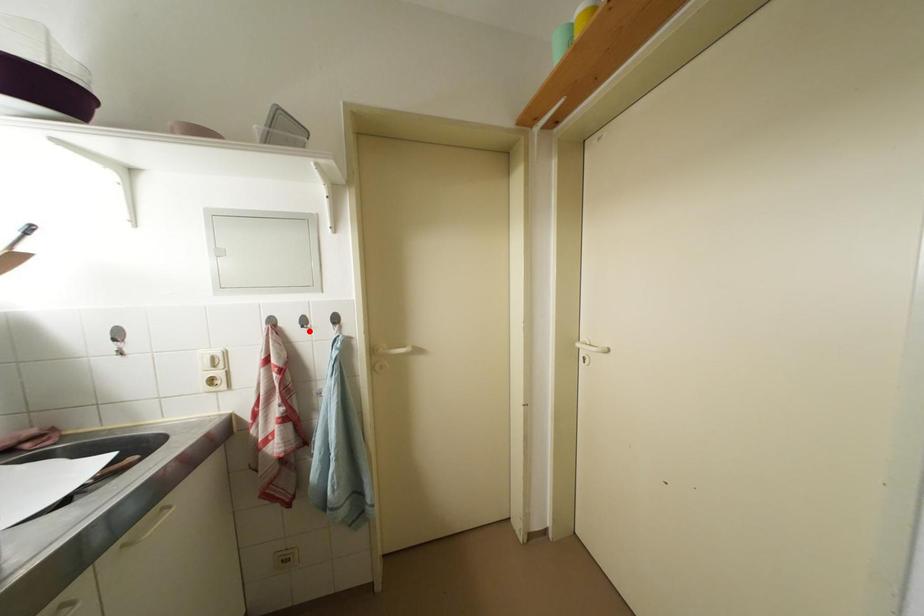
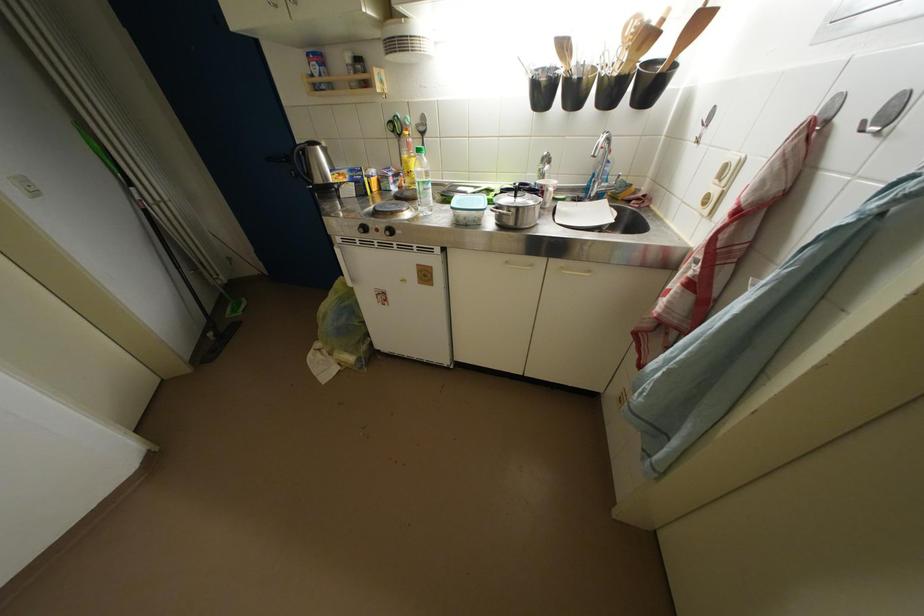
The point at the highlighted location is marked in the first image. Where is the corresponding point in the second image?

(869, 132)